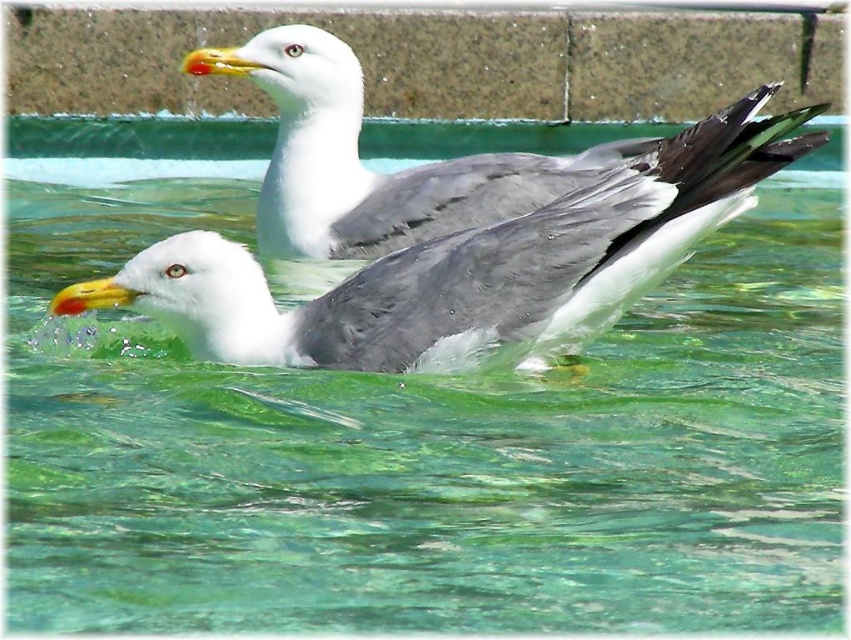
Is gray matte seagull at center to the right of white matte seagull at upper center from the viewer's perspective?

Indeed, gray matte seagull at center is positioned on the right side of white matte seagull at upper center.

Is gray matte seagull at center taller than white matte seagull at upper center?

No.

Who is more forward, (x=626, y=209) or (x=273, y=248)?

Point (x=626, y=209) is in front.

Identify the location of gray matte seagull at center. (467, 264).